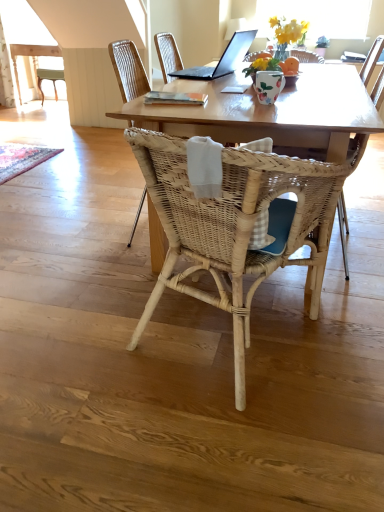
Question: Is woven rattan chair at center wider than rustic woven mat at lower left?

Choices:
 (A) yes
 (B) no

Answer: (B)

Question: Does woven rattan chair at center have a larger size compared to rustic woven mat at lower left?

Choices:
 (A) no
 (B) yes

Answer: (B)

Question: From the image's perspective, is woven rattan chair at center over rustic woven mat at lower left?

Choices:
 (A) yes
 (B) no

Answer: (B)

Question: Does woven rattan chair at center appear on the right side of rustic woven mat at lower left?

Choices:
 (A) yes
 (B) no

Answer: (A)

Question: From the image's perspective, is woven rattan chair at center under rustic woven mat at lower left?

Choices:
 (A) no
 (B) yes

Answer: (B)

Question: From the image's perspective, is black matte laptop at upper center positioned above or below woven wood chair at center, which is counted as the second chair, starting from the front?

Choices:
 (A) below
 (B) above

Answer: (B)

Question: Do you think black matte laptop at upper center is within woven wood chair at center, which is counted as the 1th chair, starting from the back, or outside of it?

Choices:
 (A) inside
 (B) outside

Answer: (B)

Question: Based on their sizes in the image, would you say black matte laptop at upper center is bigger or smaller than woven wood chair at center, which is counted as the 1th chair, starting from the back?

Choices:
 (A) big
 (B) small

Answer: (B)

Question: Would you say black matte laptop at upper center is to the left or to the right of woven wood chair at center, which is counted as the second chair, starting from the front, in the picture?

Choices:
 (A) right
 (B) left

Answer: (A)

Question: Would you say floral ceramic vase at upper center is to the left or to the right of light wood table at upper left in the picture?

Choices:
 (A) right
 (B) left

Answer: (A)

Question: Considering their positions, is floral ceramic vase at upper center located in front of or behind light wood table at upper left?

Choices:
 (A) front
 (B) behind

Answer: (A)

Question: Choose the correct answer: Is floral ceramic vase at upper center inside light wood table at upper left or outside it?

Choices:
 (A) outside
 (B) inside

Answer: (A)

Question: Considering the positions of floral ceramic vase at upper center and light wood table at upper left in the image, is floral ceramic vase at upper center taller or shorter than light wood table at upper left?

Choices:
 (A) short
 (B) tall

Answer: (A)

Question: From the image's perspective, is natural wood table at center located above or below woven wood chair at center, positioned as the first chair in front-to-back order?

Choices:
 (A) below
 (B) above

Answer: (B)

Question: Relative to woven wood chair at center, the 2th chair positioned from the back, is natural wood table at center in front or behind?

Choices:
 (A) behind
 (B) front

Answer: (A)